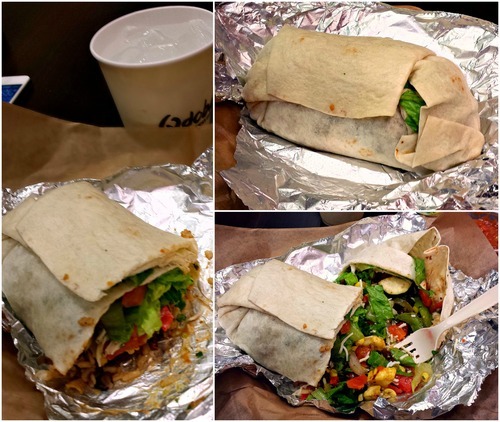
The image size is (500, 422). What are the coordinates of `cup` in the screenshot? It's located at (144, 86).